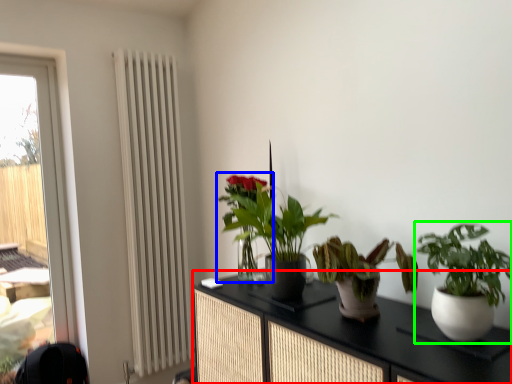
Question: Estimate the real-world distances between objects in this image. Which object is closer to cabinetry (highlighted by a red box), houseplant (highlighted by a blue box) or houseplant (highlighted by a green box)?

Choices:
 (A) houseplant
 (B) houseplant

Answer: (B)